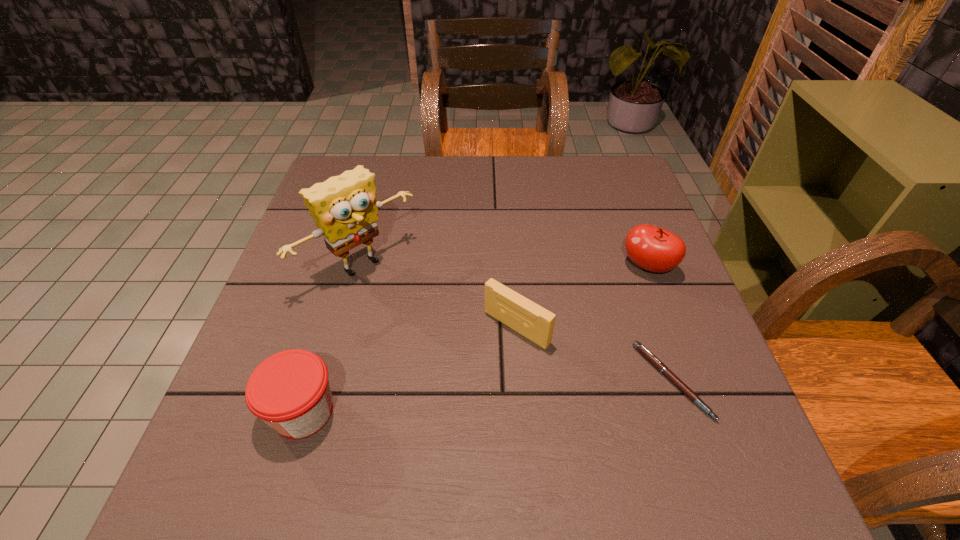
I want to click on vacant space on the desktop that is between the third tallest object and the shortest object and is positioned on the stem of the apple, so click(x=535, y=392).

The image size is (960, 540). Find the location of `vacant space on the desktop that is between the third tallest object and the pen and is positioned at the front of the fourth tallest object with spools`. vacant space on the desktop that is between the third tallest object and the pen and is positioned at the front of the fourth tallest object with spools is located at coordinates (448, 400).

You are a GUI agent. You are given a task and a screenshot of the screen. Output one action in this format:
    pyautogui.click(x=<x>, y=<y>)
    Task: Click on the vacant spot on the desktop that is between the jam and the pen and is positioned on the face of the tallest object
    
    Given the screenshot: What is the action you would take?
    pyautogui.click(x=495, y=395)